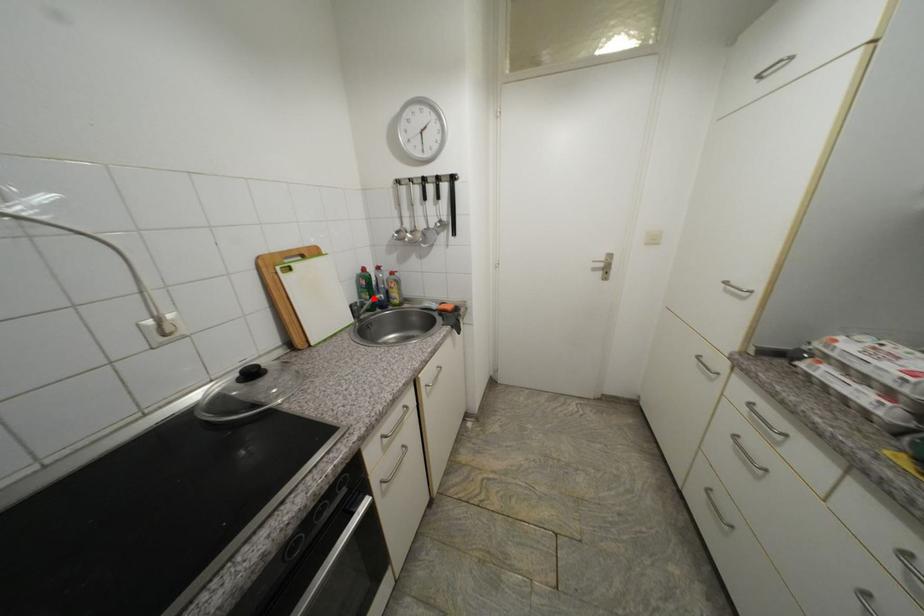
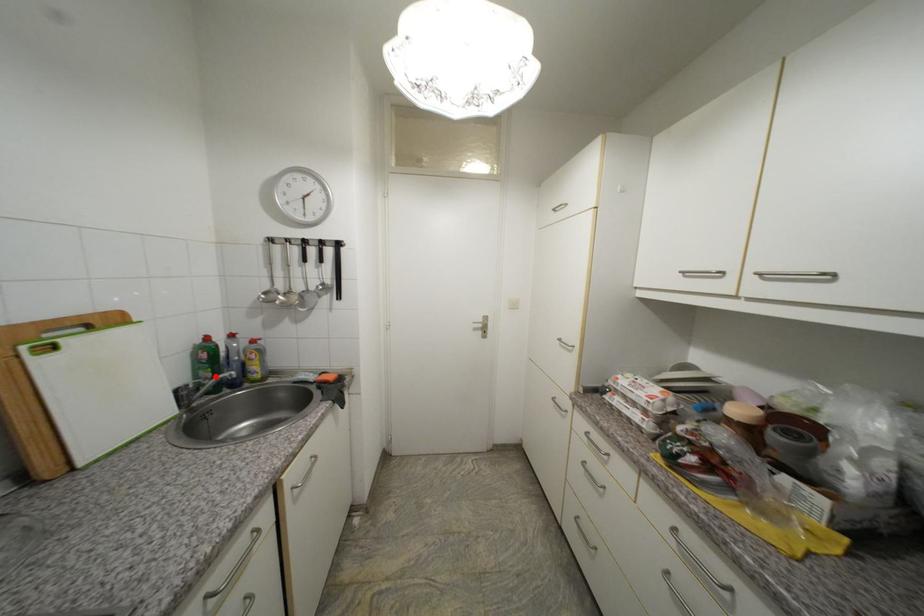
I am providing you with two images of the same scene from different viewpoints. A red point is marked on the first image and another point is marked on the second image. Do the highlighted points in image1 and image2 indicate the same real-world spot?

Yes